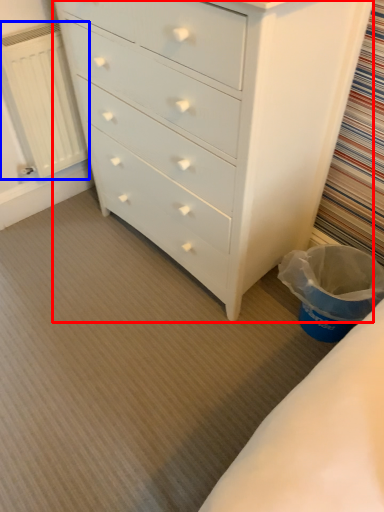
Question: Which object is further to the camera taking this photo, chest of drawers (highlighted by a red box) or radiator (highlighted by a blue box)?

Choices:
 (A) chest of drawers
 (B) radiator

Answer: (B)